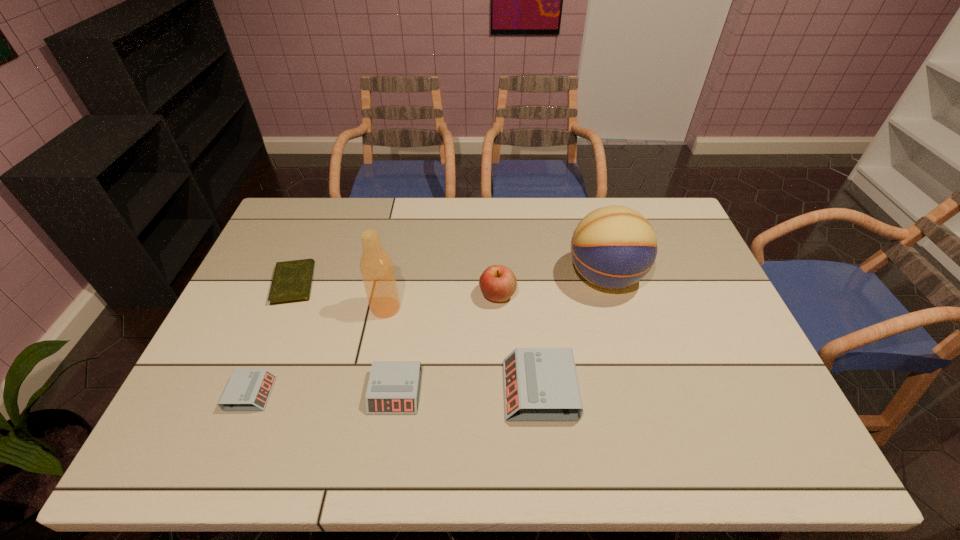
Locate an element on the screen. The height and width of the screenshot is (540, 960). the leftmost alarm clock is located at coordinates (247, 389).

The image size is (960, 540). In order to click on the sixth tallest object in this screenshot , I will do `click(247, 389)`.

Where is `the fifth tallest object`? The width and height of the screenshot is (960, 540). the fifth tallest object is located at coordinates (394, 386).

The height and width of the screenshot is (540, 960). What are the coordinates of `the second shortest alarm clock` in the screenshot? It's located at (394, 386).

Locate an element on the screen. the tallest alarm clock is located at coordinates (541, 384).

The width and height of the screenshot is (960, 540). I want to click on the rightmost alarm clock, so click(x=541, y=384).

You are a GUI agent. You are given a task and a screenshot of the screen. Output one action in this format:
    pyautogui.click(x=<x>, y=<y>)
    Task: Click on the diary
    The height and width of the screenshot is (540, 960).
    Given the screenshot: What is the action you would take?
    tap(292, 280)

I want to click on basketball, so click(x=613, y=247).

I want to click on beer bottle, so click(376, 266).

Where is `the fifth shortest object`? the fifth shortest object is located at coordinates (498, 283).